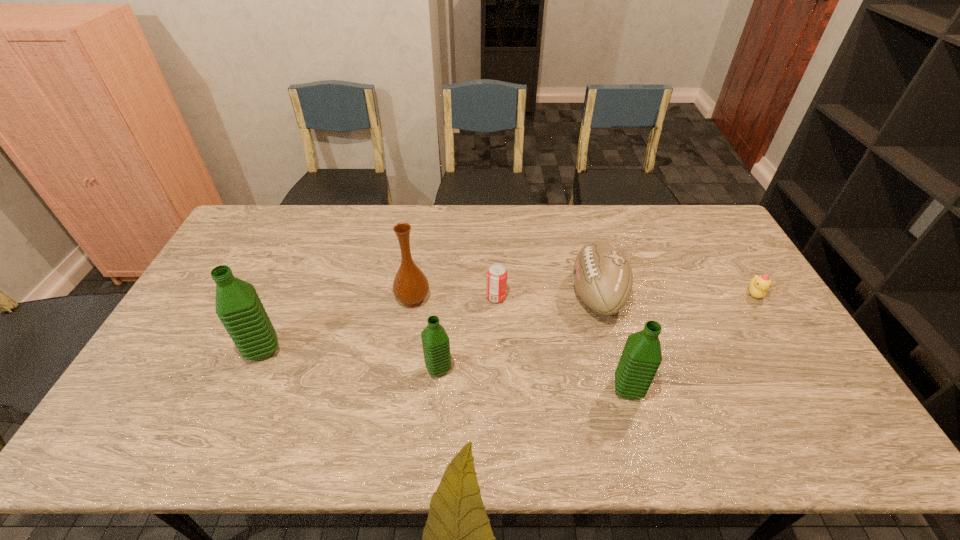
Locate an element on the screen. This screenshot has height=540, width=960. object positioned at the right edge is located at coordinates (758, 286).

Image resolution: width=960 pixels, height=540 pixels. Identify the location of vacant space at the far edge of the desktop. click(x=439, y=205).

Locate an element on the screen. vacant area at the near edge of the desktop is located at coordinates (406, 412).

Where is `vacant space at the left edge of the desktop`? vacant space at the left edge of the desktop is located at coordinates (215, 264).

At what (x,y) coordinates should I click in order to perform the action: click on vacant space at the right edge of the desktop. Please return your answer as a coordinate pair (x, y). Looking at the image, I should click on (768, 333).

Identify the location of vacant area at the far left corner. The height and width of the screenshot is (540, 960). (249, 235).

In the image, there is a desktop. At what (x,y) coordinates should I click in order to perform the action: click on vacant space at the near right corner. Please return your answer as a coordinate pair (x, y). The height and width of the screenshot is (540, 960). Looking at the image, I should click on (828, 409).

Find the location of a particular element. The height and width of the screenshot is (540, 960). vacant area that lies between the vase and the soda can is located at coordinates (454, 298).

Identify the location of unoccupied position between the third shortest object and the fourth shortest object. This screenshot has height=540, width=960. (517, 333).

The height and width of the screenshot is (540, 960). In order to click on blank region between the third object from left to right and the soda can in this screenshot , I will do `click(468, 333)`.